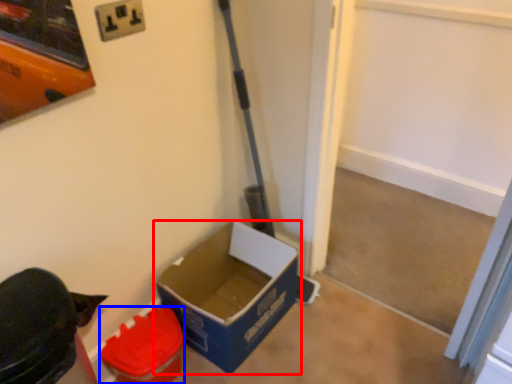
Question: Which point is closer to the camera, box (highlighted by a red box) or box (highlighted by a blue box)?

Choices:
 (A) box
 (B) box

Answer: (B)